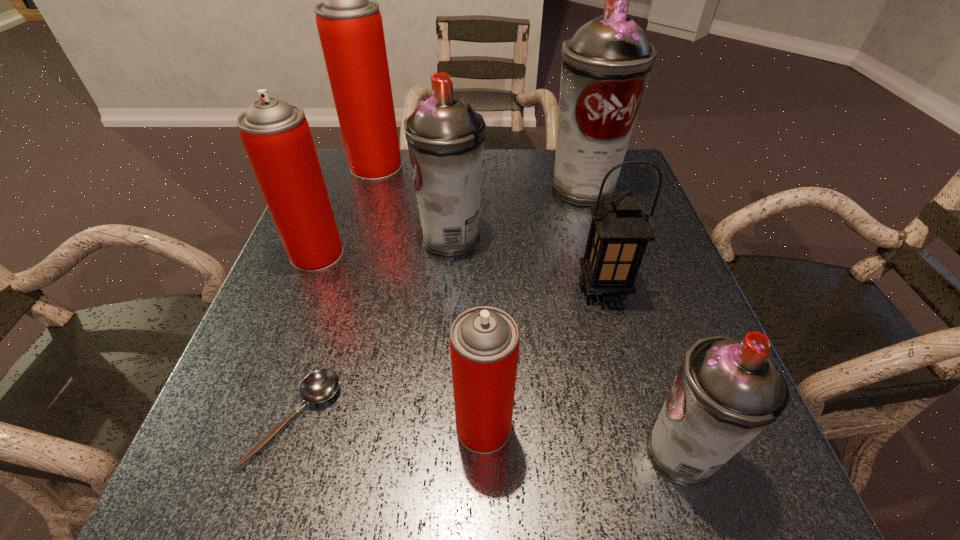
Identify which object is the sixth nearest to the biggest gray aerosol can. Please provide its 2D coordinates. Your answer should be formatted as a tuple, i.e. [(x, y)], where the tuple contains the x and y coordinates of a point satisfying the conditions above.

[(727, 391)]

Identify the location of aerosol can that is the second closest to the gray ladle. This screenshot has width=960, height=540. click(x=276, y=135).

What are the coordinates of `aerosol can that stands as the third closest to the second smallest gray aerosol can` in the screenshot? It's located at (349, 22).

What are the coordinates of `the closest red aerosol can relative to the gray ladle` in the screenshot? It's located at click(x=484, y=341).

Identify which red aerosol can is the closest to the second biggest red aerosol can. Please provide its 2D coordinates. Your answer should be formatted as a tuple, i.e. [(x, y)], where the tuple contains the x and y coordinates of a point satisfying the conditions above.

[(349, 22)]

You are a GUI agent. You are given a task and a screenshot of the screen. Output one action in this format:
    pyautogui.click(x=<x>, y=<y>)
    Task: Click on the second closest gray aerosol can relative to the biggest gray aerosol can
    This screenshot has width=960, height=540.
    Given the screenshot: What is the action you would take?
    pyautogui.click(x=727, y=391)

In order to click on gray aerosol can that stands as the second closest to the nearest gray aerosol can in this screenshot , I will do `click(606, 65)`.

The image size is (960, 540). What are the coordinates of `vacant point that satisfies the following two spatial constraints: 1. on the back side of the second smallest gray aerosol can; 2. on the left side of the ladle` in the screenshot? It's located at (352, 238).

At what (x,y) coordinates should I click in order to perform the action: click on free spot that satisfies the following two spatial constraints: 1. on the front side of the shortest object; 2. on the left side of the smallest gray aerosol can. Please return your answer as a coordinate pair (x, y). This screenshot has width=960, height=540. Looking at the image, I should click on (284, 453).